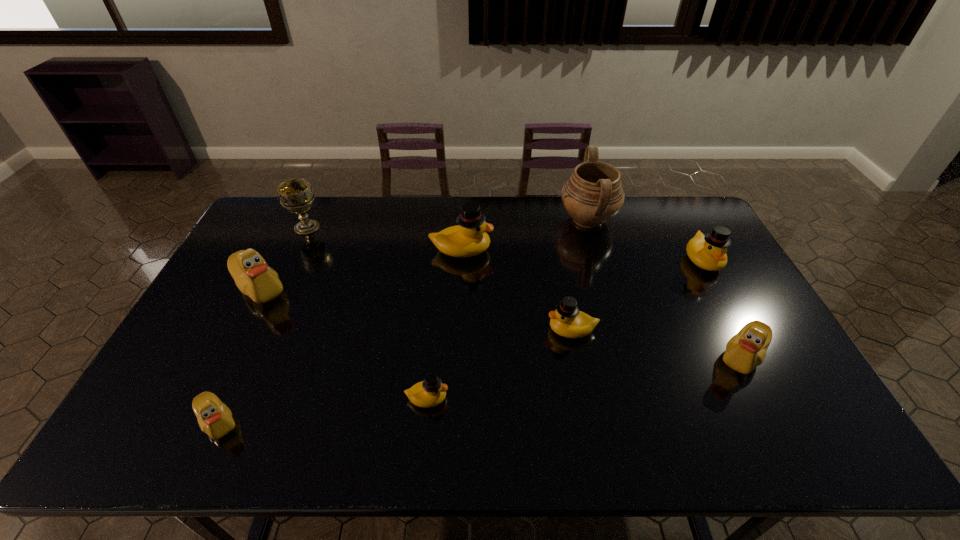
Locate an element on the screen. This screenshot has height=540, width=960. the nearest yellow duck is located at coordinates (431, 392).

Find the location of `vacant space located 0.220m on the front-facing side of the urn`. vacant space located 0.220m on the front-facing side of the urn is located at coordinates (498, 220).

The height and width of the screenshot is (540, 960). I want to click on vacant area located 0.160m on the front-facing side of the urn, so click(515, 220).

Locate an element on the screen. free space located 0.350m on the front-facing side of the urn is located at coordinates (463, 220).

I want to click on vacant space located on the front-facing side of the biggest yellow duck, so click(x=558, y=250).

Locate an element on the screen. Image resolution: width=960 pixels, height=540 pixels. vacant area located on the front of the white chalice is located at coordinates (284, 277).

Identify the location of free space located 0.390m at the beak of the farthest beige duck. (186, 434).

Locate an element on the screen. This screenshot has width=960, height=540. free space located 0.300m on the front-facing side of the third smallest yellow duck is located at coordinates [x=756, y=357].

The width and height of the screenshot is (960, 540). Find the location of `free spot located 0.080m at the beak of the second biggest beige duck`. free spot located 0.080m at the beak of the second biggest beige duck is located at coordinates (686, 356).

The height and width of the screenshot is (540, 960). Find the location of `free spot located at the beak of the second biggest beige duck`. free spot located at the beak of the second biggest beige duck is located at coordinates (593, 356).